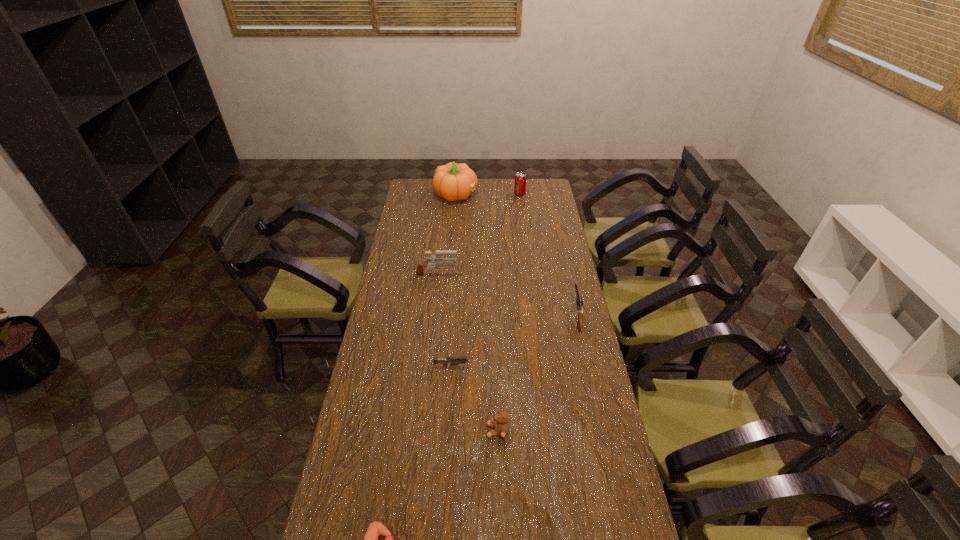
Point out which gun is positioned as the nearest to the pumpkin. Please provide its 2D coordinates. Your answer should be formatted as a tuple, i.e. [(x, y)], where the tuple contains the x and y coordinates of a point satisfying the conditions above.

[(439, 260)]

Identify the location of vacant region that satisfies the following two spatial constraints: 1. along the barrel of the rightmost object; 2. on the carved face of the tallest object. (548, 194).

Locate an element on the screen. Image resolution: width=960 pixels, height=540 pixels. free space that satisfies the following two spatial constraints: 1. along the barrel of the second tallest gun; 2. on the carved face of the tallest object is located at coordinates (548, 194).

Where is `free space that satisfies the following two spatial constraints: 1. on the carved face of the pumpkin; 2. along the barrel of the second farthest gun`? free space that satisfies the following two spatial constraints: 1. on the carved face of the pumpkin; 2. along the barrel of the second farthest gun is located at coordinates point(446,316).

Find the location of `free spot that satisfies the following two spatial constraints: 1. at the barrel end of the third farthest object; 2. along the barrel of the second farthest gun`. free spot that satisfies the following two spatial constraints: 1. at the barrel end of the third farthest object; 2. along the barrel of the second farthest gun is located at coordinates click(x=433, y=316).

Find the location of a particular element. Image resolution: width=960 pixels, height=540 pixels. vacant position in the image that satisfies the following two spatial constraints: 1. at the barrel end of the tallest gun; 2. along the barrel of the fourth farthest object is located at coordinates (433, 316).